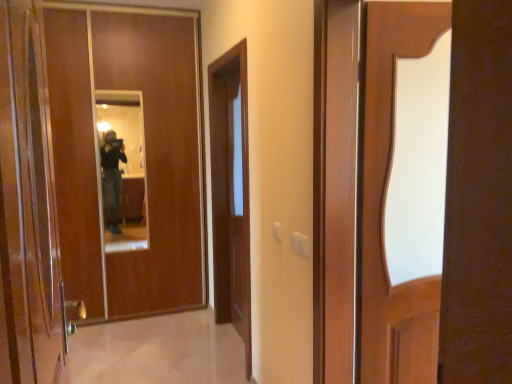
Question: Can you confirm if matte wooden mirror at center is taller than brown wooden door at center?

Choices:
 (A) yes
 (B) no

Answer: (B)

Question: Is matte wooden mirror at center positioned beyond the bounds of brown wooden door at center?

Choices:
 (A) no
 (B) yes

Answer: (B)

Question: From the image's perspective, does matte wooden mirror at center appear lower than brown wooden door at center?

Choices:
 (A) yes
 (B) no

Answer: (B)

Question: Considering the relative sizes of matte wooden mirror at center and brown wooden door at center in the image provided, is matte wooden mirror at center smaller than brown wooden door at center?

Choices:
 (A) yes
 (B) no

Answer: (A)

Question: Is matte wooden mirror at center oriented towards brown wooden door at center?

Choices:
 (A) yes
 (B) no

Answer: (B)

Question: Is the depth of matte wooden mirror at center less than that of brown wooden door at center?

Choices:
 (A) no
 (B) yes

Answer: (A)

Question: Is the depth of matte wooden mirror at center greater than that of shiny brown door at left, the 2th door positioned from the back?

Choices:
 (A) yes
 (B) no

Answer: (A)

Question: Is matte wooden mirror at center taller than shiny brown door at left, the 1th door positioned from the front?

Choices:
 (A) no
 (B) yes

Answer: (B)

Question: Is matte wooden mirror at center located outside shiny brown door at left, the 2th door positioned from the back?

Choices:
 (A) no
 (B) yes

Answer: (B)

Question: Is matte wooden mirror at center next to shiny brown door at left, the 1th door positioned from the front, and touching it?

Choices:
 (A) yes
 (B) no

Answer: (B)

Question: Is matte wooden mirror at center positioned with its back to shiny brown door at left, the 2th door positioned from the back?

Choices:
 (A) yes
 (B) no

Answer: (B)

Question: From the image's perspective, is matte wooden mirror at center on top of shiny brown door at left, the 1th door positioned from the front?

Choices:
 (A) yes
 (B) no

Answer: (A)

Question: From the image's perspective, would you say shiny brown door at left, the 2th door positioned from the back, is positioned over brown wooden door at center?

Choices:
 (A) no
 (B) yes

Answer: (B)